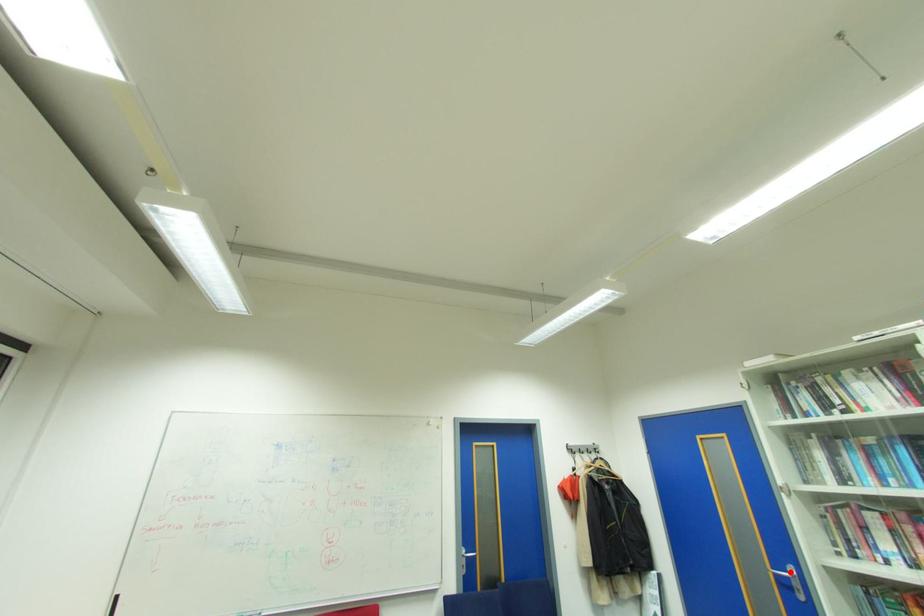
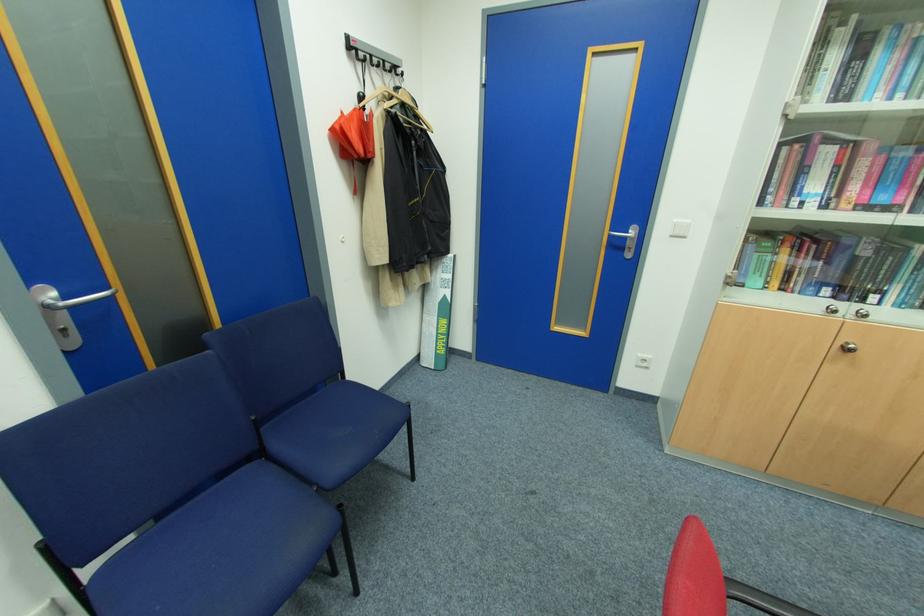
In the second image, find the point that corresponds to the highlighted location in the first image.

(630, 233)